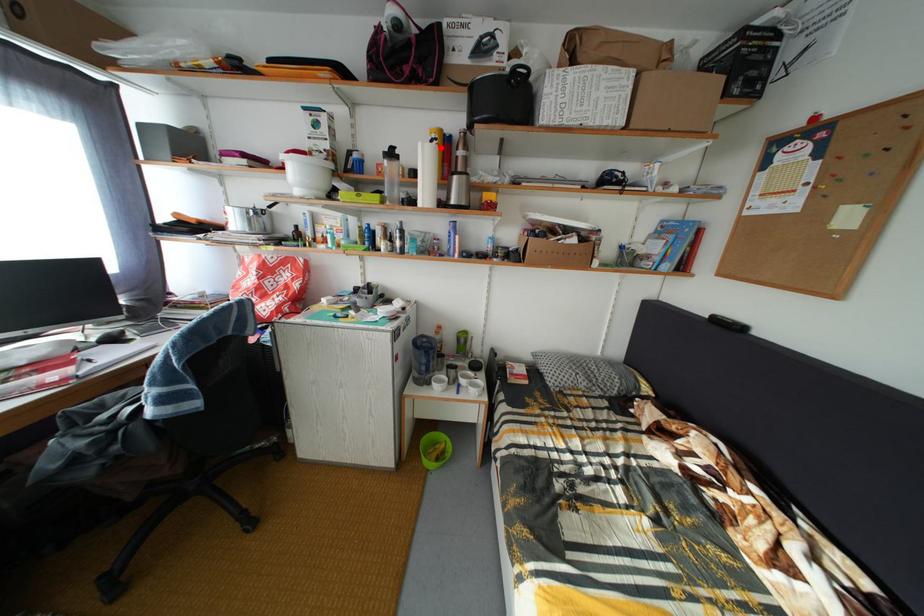
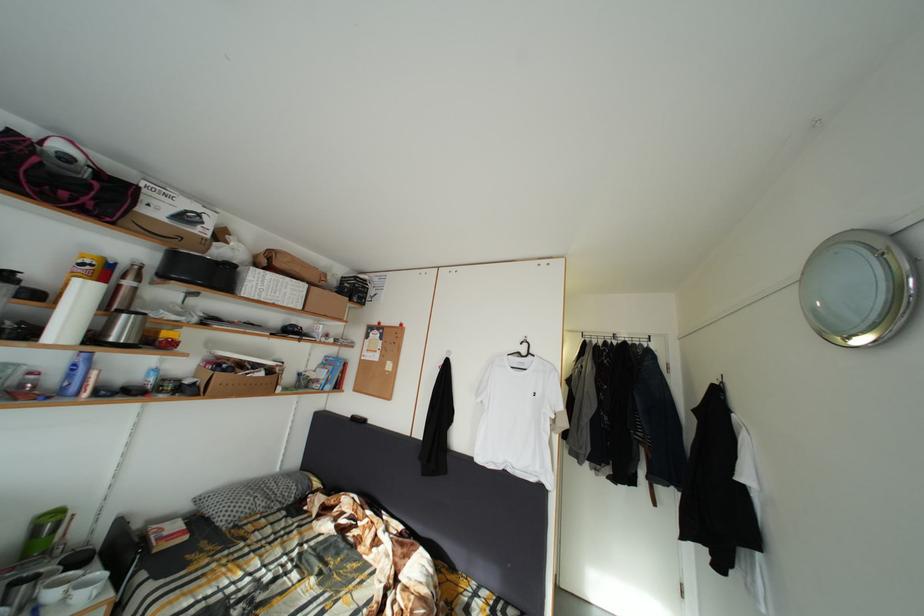
The point at the highlighted location is marked in the first image. Where is the corresponding point in the second image?

(91, 270)